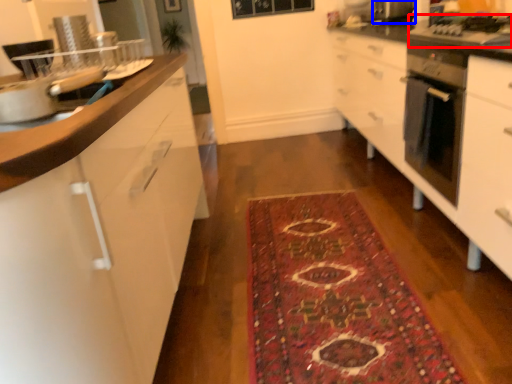
Question: Which object appears farthest to the camera in this image, gas stove (highlighted by a red box) or appliance (highlighted by a blue box)?

Choices:
 (A) gas stove
 (B) appliance

Answer: (B)